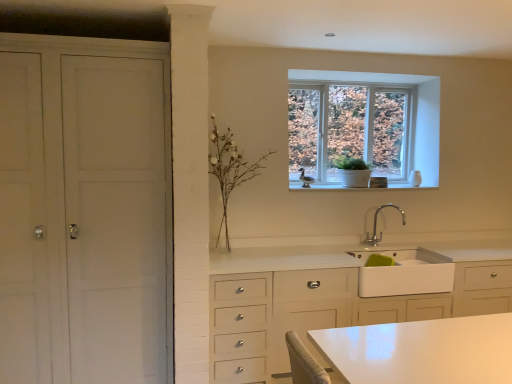
The width and height of the screenshot is (512, 384). Identify the location of clear glass window at upper center. (364, 125).

The image size is (512, 384). Describe the element at coordinates (85, 210) in the screenshot. I see `white matte cabinet at left` at that location.

Measure the distance between white matte cabinet at left and camera.

They are 2.46 meters apart.

This screenshot has width=512, height=384. In order to click on silver metallic faucet at upper center in this screenshot , I will do `click(376, 225)`.

Find the location of `clear glass window at upper center`. clear glass window at upper center is located at coordinates (364, 125).

Is clear glass window at upper center with white matte cabinet at left?

clear glass window at upper center and white matte cabinet at left are not in contact.

Which is in front, point (380, 105) or point (137, 277)?

The point (137, 277) is in front.

Consider the image. Between clear glass window at upper center and white matte cabinet at left, which one is positioned behind?

clear glass window at upper center is further away from the camera.

Locate an element on the screen. cupboard that appears on the left of clear glass window at upper center is located at coordinates (85, 210).

Is silver metallic faucet at upper center shorter than clear glass window at upper center?

Indeed, silver metallic faucet at upper center has a lesser height compared to clear glass window at upper center.

Is silver metallic faucet at upper center in front of or behind clear glass window at upper center in the image?

silver metallic faucet at upper center is positioned closer to the viewer than clear glass window at upper center.

This screenshot has width=512, height=384. In the image, there is a silver metallic faucet at upper center. Identify the location of window above it (from the image's perspective). (364, 125).

Between silver metallic faucet at upper center and clear glass window at upper center, which one has larger size?

clear glass window at upper center.

Which is correct: silver metallic faucet at upper center is inside white matte plant at center, or outside of it?

silver metallic faucet at upper center is not enclosed by white matte plant at center.

Considering the sizes of objects silver metallic faucet at upper center and white matte plant at center in the image provided, who is bigger, silver metallic faucet at upper center or white matte plant at center?

white matte plant at center is bigger.

Is point (370, 237) in front of point (227, 174)?

That is False.

From their relative heights in the image, would you say white matte plant at center is taller or shorter than clear glass window at upper center?

Considering their sizes, white matte plant at center has more height than clear glass window at upper center.

Is white matte plant at center with clear glass window at upper center?

No, white matte plant at center is not next to clear glass window at upper center.

From the image's perspective, is white matte plant at center under clear glass window at upper center?

Yes, from the image's perspective, white matte plant at center is beneath clear glass window at upper center.

Image resolution: width=512 pixels, height=384 pixels. In order to click on plant located in front of the clear glass window at upper center in this screenshot , I will do `click(229, 169)`.

From a real-world perspective, which object stands above the other?

white matte cabinet at left, from a real-world perspective.

Considering the points (167, 331) and (374, 296), which point is behind, point (167, 331) or point (374, 296)?

The point (374, 296) is farther from the camera.

Is white matte cabinet at left turned away from white matte sink at lower center?

No.

How many degrees apart are the facing directions of white matte cabinet at left and white matte sink at lower center?

The facing directions of white matte cabinet at left and white matte sink at lower center are 0.293 degrees apart.

Locate an element on the screen. window that is above the silver metallic faucet at upper center (from the image's perspective) is located at coordinates (364, 125).

Between clear glass window at upper center and silver metallic faucet at upper center, which one has smaller width?

clear glass window at upper center.

From the image's perspective, is clear glass window at upper center above or below silver metallic faucet at upper center?

Based on their image positions, clear glass window at upper center is located above silver metallic faucet at upper center.

Which is more to the left, white matte sink at lower center or white matte plant at center?

white matte plant at center.

From the image's perspective, is white matte sink at lower center below white matte plant at center?

Correct, white matte sink at lower center appears lower than white matte plant at center in the image.

Considering the positions of objects white matte sink at lower center and white matte plant at center in the image provided, who is in front, white matte sink at lower center or white matte plant at center?

white matte plant at center is closer to the camera.

The height and width of the screenshot is (384, 512). I want to click on cupboard beneath the clear glass window at upper center (from a real-world perspective), so click(x=85, y=210).

This screenshot has height=384, width=512. In order to click on window that is above the silver metallic faucet at upper center (from the image's perspective) in this screenshot , I will do `click(364, 125)`.

Considering their positions, is clear glass window at upper center positioned further to white matte sink at lower center than silver metallic faucet at upper center?

clear glass window at upper center lies further to white matte sink at lower center than the other object.

Estimate the real-world distances between objects in this image. Which object is further from clear glass window at upper center, silver metallic faucet at upper center or white matte cabinet at left?

Based on the image, white matte cabinet at left appears to be further to clear glass window at upper center.

Looking at the image, which one is located closer to white matte sink at lower center, silver metallic faucet at upper center or clear glass window at upper center?

Among the two, silver metallic faucet at upper center is located nearer to white matte sink at lower center.

Considering their positions, is white matte plant at center positioned closer to silver metallic faucet at upper center than white matte sink at lower center?

white matte sink at lower center is positioned closer to the anchor silver metallic faucet at upper center.

Considering their positions, is clear glass window at upper center positioned further to silver metallic faucet at upper center than white matte sink at lower center?

clear glass window at upper center.

Estimate the real-world distances between objects in this image. Which object is further from silver metallic faucet at upper center, clear glass window at upper center or white matte plant at center?

white matte plant at center.

When comparing their distances from white matte cabinet at left, does silver metallic faucet at upper center or white matte sink at lower center seem closer?

white matte sink at lower center lies closer to white matte cabinet at left than the other object.

Which object lies further to the anchor point silver metallic faucet at upper center, white matte cabinet at left or white matte plant at center?

Based on the image, white matte cabinet at left appears to be further to silver metallic faucet at upper center.

In order to click on window between white matte cabinet at left and white matte sink at lower center in this screenshot , I will do `click(364, 125)`.

You are a GUI agent. You are given a task and a screenshot of the screen. Output one action in this format:
    pyautogui.click(x=<x>, y=<y>)
    Task: Click on the tap between white matte cabinet at left and white matte sink at lower center from left to right
    The image size is (512, 384).
    Given the screenshot: What is the action you would take?
    pyautogui.click(x=376, y=225)

Where is `plant situated between white matte cabinet at left and clear glass window at upper center from left to right`? plant situated between white matte cabinet at left and clear glass window at upper center from left to right is located at coordinates (229, 169).

I want to click on tap between white matte plant at center and white matte sink at lower center from left to right, so click(376, 225).